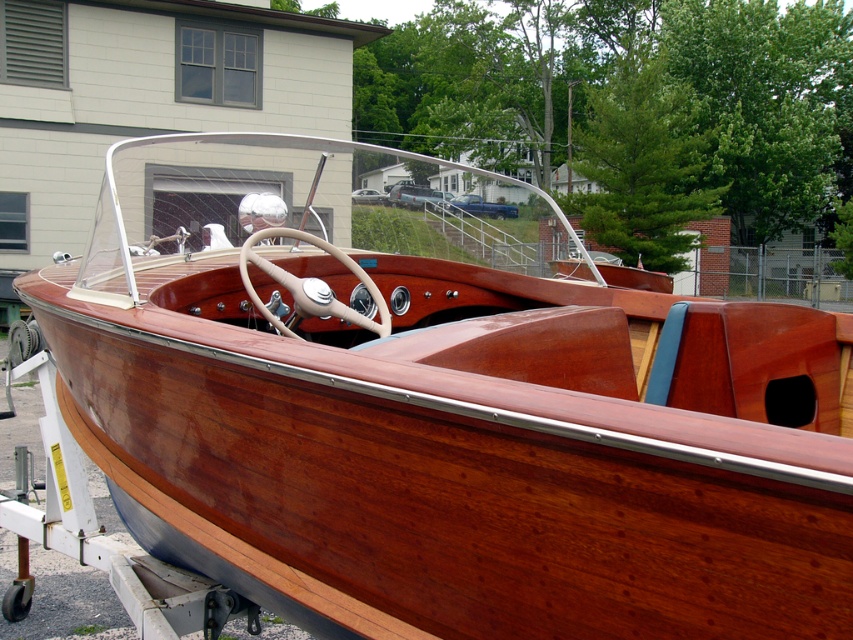
Question: Can you confirm if blue metallic truck at center is smaller than metallic silver car at center?

Choices:
 (A) no
 (B) yes

Answer: (B)

Question: Is blue metallic truck at center thinner than metallic silver car at center?

Choices:
 (A) no
 (B) yes

Answer: (A)

Question: Which of the following is the closest to the observer?

Choices:
 (A) blue metallic truck at center
 (B) metallic silver car at center

Answer: (A)

Question: Is blue metallic truck at center behind metallic silver car at center?

Choices:
 (A) yes
 (B) no

Answer: (B)